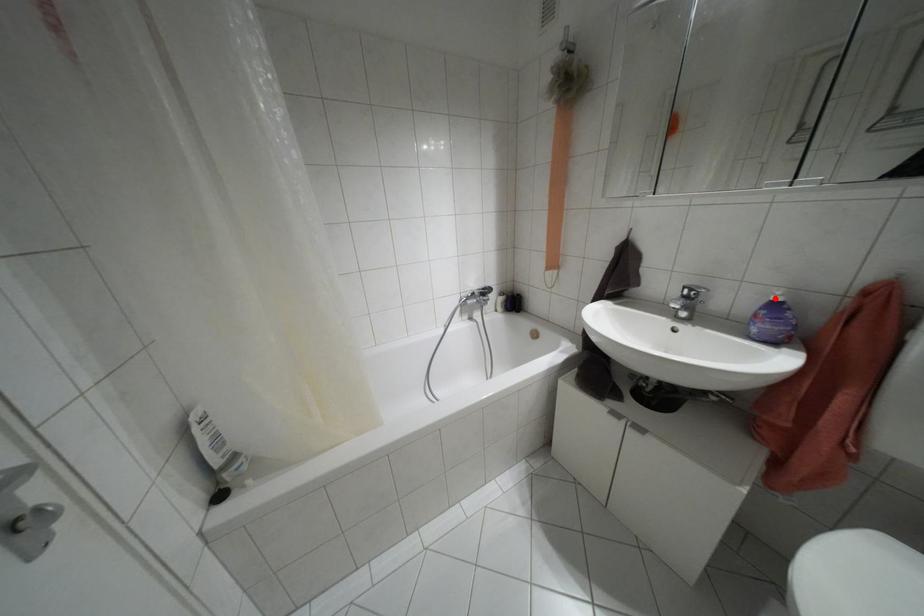
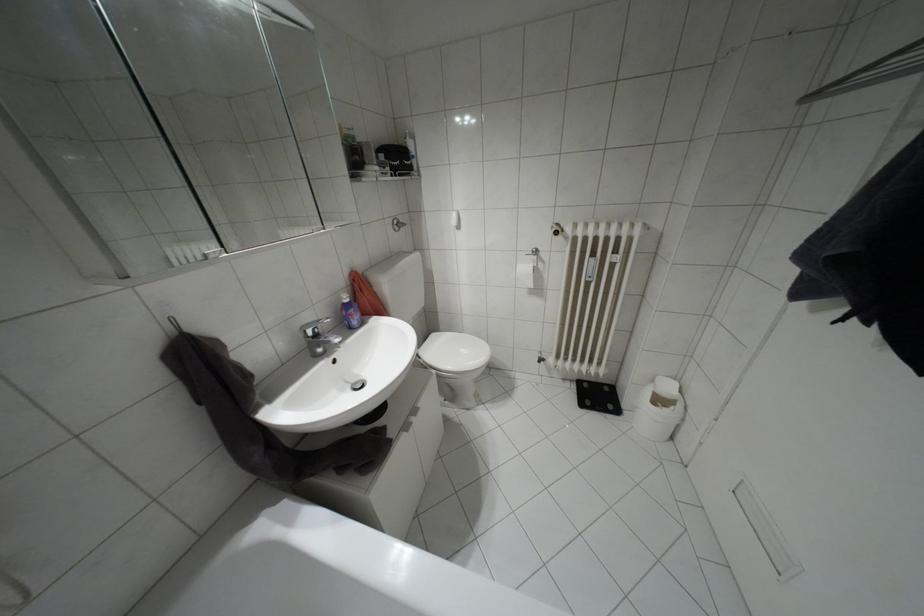
Where in the second image is the point corresponding to the highlighted location from the first image?

(346, 300)